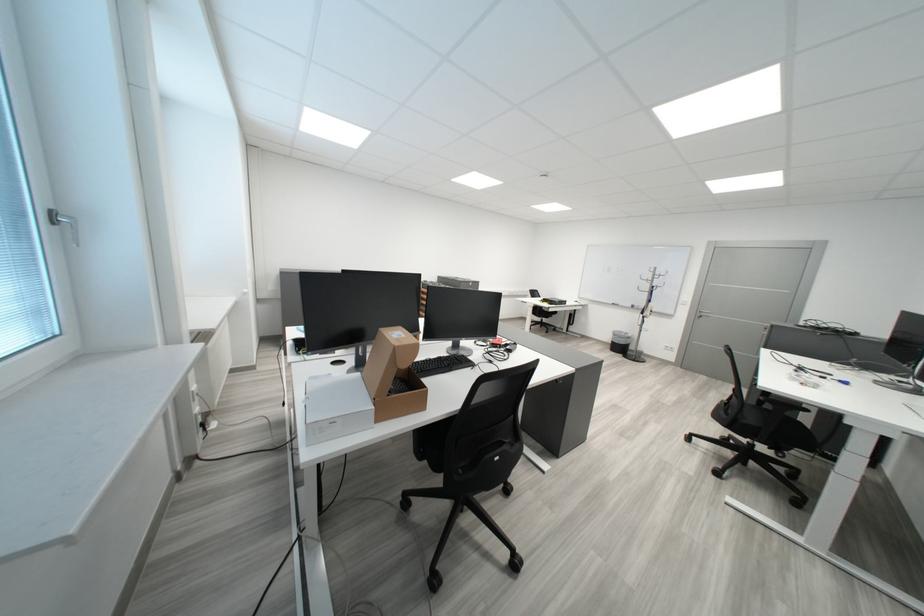
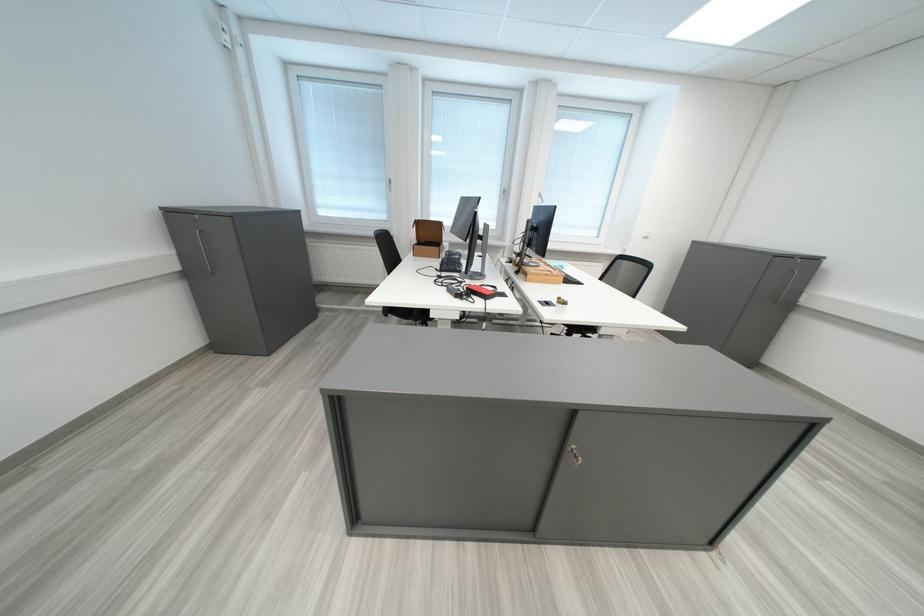
Question: I am providing you with two images of the same scene from different viewpoints. Which of the following objects are not visible in image2?

Choices:
 (A) cardboard box
 (B) black computer keyboard
 (C) wooden desk tray
 (D) red locking lever

Answer: (B)